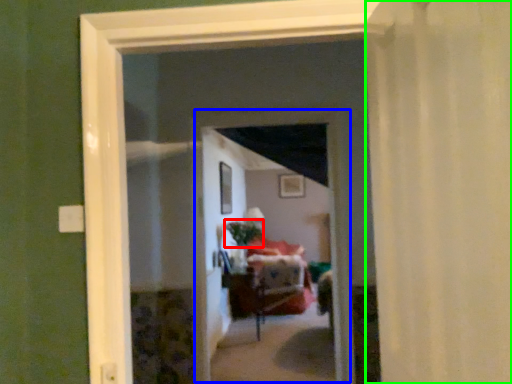
Question: Which object is the farthest from plant (highlighted by a red box)? Choose among these: screen door (highlighted by a blue box) or curtain (highlighted by a green box).

Choices:
 (A) screen door
 (B) curtain

Answer: (B)